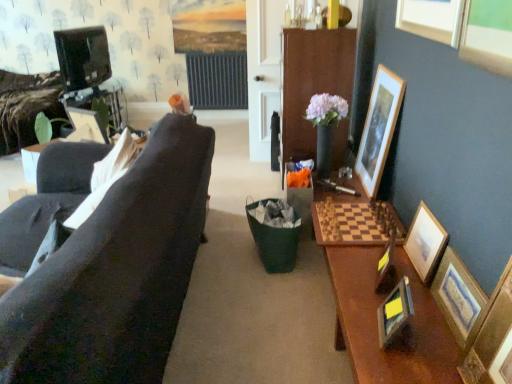
Question: Does wooden picture frame at right, arranged as the 2th picture frame when viewed from the right, have a lesser height compared to wooden picture frame at right, the 5th picture frame from the left?

Choices:
 (A) yes
 (B) no

Answer: (A)

Question: Could you tell me if wooden picture frame at right, arranged as the 2th picture frame when viewed from the right, is facing wooden picture frame at right, the 5th picture frame from the left?

Choices:
 (A) yes
 (B) no

Answer: (B)

Question: Does wooden picture frame at right, placed as the 6th picture frame when sorted from left to right, have a larger size compared to wooden picture frame at right, the 3th picture frame from the right?

Choices:
 (A) yes
 (B) no

Answer: (B)

Question: From the image's perspective, is wooden picture frame at right, placed as the 6th picture frame when sorted from left to right, located above wooden picture frame at right, the 5th picture frame from the left?

Choices:
 (A) yes
 (B) no

Answer: (B)

Question: Is wooden picture frame at right, arranged as the 2th picture frame when viewed from the right, positioned beyond the bounds of wooden picture frame at right, the 5th picture frame from the left?

Choices:
 (A) no
 (B) yes

Answer: (B)

Question: From a real-world perspective, is wooden picture frame at right, the 5th picture frame from the left, positioned above or below wooden framed picture at right, the 1th picture frame viewed from the right?

Choices:
 (A) below
 (B) above

Answer: (B)

Question: In the image, is wooden picture frame at right, the 5th picture frame from the left, positioned in front of or behind wooden framed picture at right, placed as the 7th picture frame when sorted from left to right?

Choices:
 (A) behind
 (B) front

Answer: (A)

Question: In terms of width, does wooden picture frame at right, the 5th picture frame from the left, look wider or thinner when compared to wooden framed picture at right, placed as the 7th picture frame when sorted from left to right?

Choices:
 (A) wide
 (B) thin

Answer: (A)

Question: Is wooden picture frame at right, the 3th picture frame from the right, situated inside wooden framed picture at right, placed as the 7th picture frame when sorted from left to right, or outside?

Choices:
 (A) outside
 (B) inside

Answer: (A)

Question: Is wooden framed picture at right, placed as the 7th picture frame when sorted from left to right, taller or shorter than wooden picture frame at right, arranged as the fourth picture frame when viewed from the right?

Choices:
 (A) tall
 (B) short

Answer: (B)

Question: Considering their positions, is wooden framed picture at right, placed as the 7th picture frame when sorted from left to right, located in front of or behind wooden picture frame at right, arranged as the fourth picture frame when viewed from the right?

Choices:
 (A) behind
 (B) front

Answer: (A)

Question: From a real-world perspective, is wooden framed picture at right, placed as the 7th picture frame when sorted from left to right, positioned above or below wooden picture frame at right, arranged as the fourth picture frame when viewed from the right?

Choices:
 (A) below
 (B) above

Answer: (A)

Question: Considering the positions of wooden framed picture at right, the 1th picture frame viewed from the right, and wooden picture frame at right, arranged as the fourth picture frame when viewed from the right, in the image, is wooden framed picture at right, the 1th picture frame viewed from the right, wider or thinner than wooden picture frame at right, arranged as the fourth picture frame when viewed from the right,?

Choices:
 (A) wide
 (B) thin

Answer: (B)

Question: Is wooden picture frame at left, which is counted as the first picture frame, starting from the left, inside the boundaries of wooden cabinet at center, or outside?

Choices:
 (A) outside
 (B) inside

Answer: (A)

Question: From their relative heights in the image, would you say wooden picture frame at left, which is counted as the first picture frame, starting from the left, is taller or shorter than wooden cabinet at center?

Choices:
 (A) tall
 (B) short

Answer: (B)